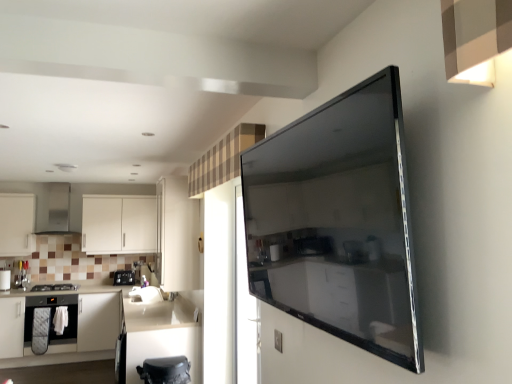
Question: Is black glass stove at left, which ranks as the 2th appliance in front-to-back order, a part of brushed metal knife block at left, which is the 2th appliance from right to left?

Choices:
 (A) no
 (B) yes

Answer: (A)

Question: Can you confirm if brushed metal knife block at left, marked as the 2th appliance in a left-to-right arrangement, is positioned to the right of black glass stove at left, the 1th appliance from the left?

Choices:
 (A) no
 (B) yes

Answer: (B)

Question: Is brushed metal knife block at left, which ranks as the 1th appliance in back-to-front order, oriented away from black glass stove at left, the 2th appliance from the back?

Choices:
 (A) no
 (B) yes

Answer: (A)

Question: Considering the relative sizes of brushed metal knife block at left, marked as the 2th appliance in a left-to-right arrangement, and black glass stove at left, the 1th appliance from the left, in the image provided, is brushed metal knife block at left, marked as the 2th appliance in a left-to-right arrangement, shorter than black glass stove at left, the 1th appliance from the left,?

Choices:
 (A) no
 (B) yes

Answer: (A)

Question: Considering the relative sizes of brushed metal knife block at left, which ranks as the 1th appliance in back-to-front order, and black glass stove at left, the 2th appliance from the back, in the image provided, is brushed metal knife block at left, which ranks as the 1th appliance in back-to-front order, bigger than black glass stove at left, the 2th appliance from the back,?

Choices:
 (A) no
 (B) yes

Answer: (B)

Question: Considering their positions, is brushed metal knife block at left, which is counted as the 3th appliance, starting from the front, located in front of or behind white matte cabinetry at left, which ranks as the sixth cabinetry in back-to-front order?

Choices:
 (A) front
 (B) behind

Answer: (B)

Question: Is brushed metal knife block at left, marked as the 2th appliance in a left-to-right arrangement, wider or thinner than white matte cabinetry at left, which ranks as the sixth cabinetry in back-to-front order?

Choices:
 (A) wide
 (B) thin

Answer: (B)

Question: Is point (14, 276) positioned closer to the camera than point (100, 357)?

Choices:
 (A) closer
 (B) farther

Answer: (B)

Question: From the image's perspective, relative to white matte cabinetry at left, acting as the 1th cabinetry starting from the front, is brushed metal knife block at left, which ranks as the 1th appliance in back-to-front order, above or below?

Choices:
 (A) below
 (B) above

Answer: (B)

Question: From the image's perspective, is black plastic toaster at left above or below white matte cabinet at left, placed as the 5th cabinetry when sorted from front to back?

Choices:
 (A) below
 (B) above

Answer: (A)

Question: Is black plastic toaster at left bigger or smaller than white matte cabinet at left, placed as the 5th cabinetry when sorted from front to back?

Choices:
 (A) big
 (B) small

Answer: (B)

Question: In terms of width, does black plastic toaster at left look wider or thinner when compared to white matte cabinet at left, placed as the 5th cabinetry when sorted from front to back?

Choices:
 (A) thin
 (B) wide

Answer: (A)

Question: Does point (118, 279) appear closer or farther from the camera than point (6, 253)?

Choices:
 (A) farther
 (B) closer

Answer: (A)

Question: Considering the relative positions of black plastic toaster at left and brushed metal knife block at left, which is counted as the 3th appliance, starting from the front, in the image provided, is black plastic toaster at left to the left or to the right of brushed metal knife block at left, which is counted as the 3th appliance, starting from the front,?

Choices:
 (A) right
 (B) left

Answer: (A)

Question: In the image, is black plastic toaster at left positioned in front of or behind brushed metal knife block at left, which is counted as the 3th appliance, starting from the front?

Choices:
 (A) front
 (B) behind

Answer: (B)